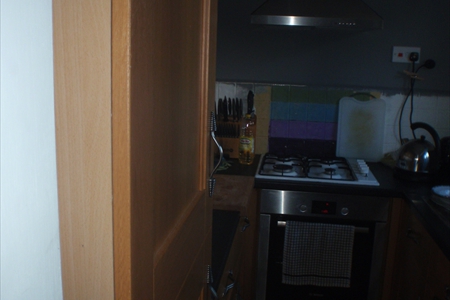
I want to click on red reset outlet button, so click(400, 55).